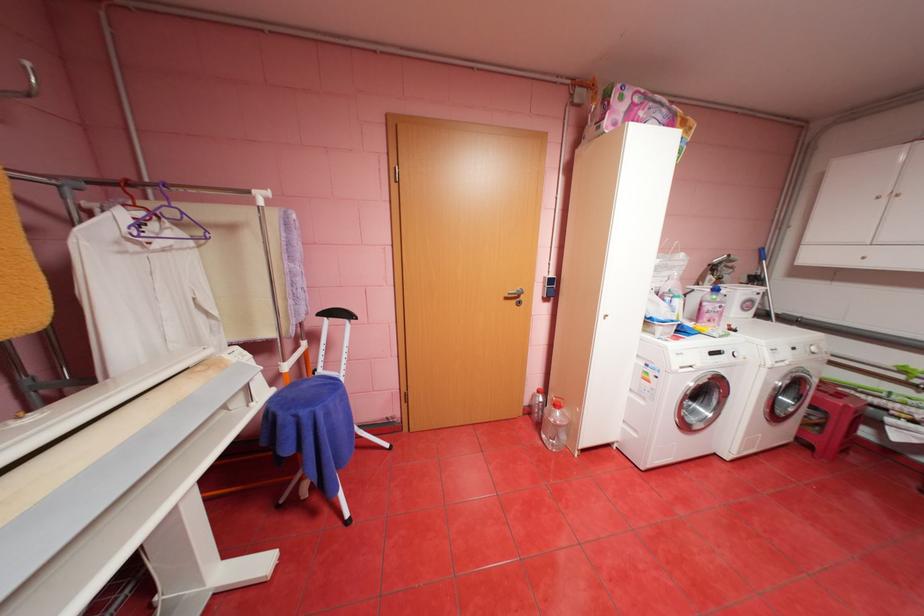
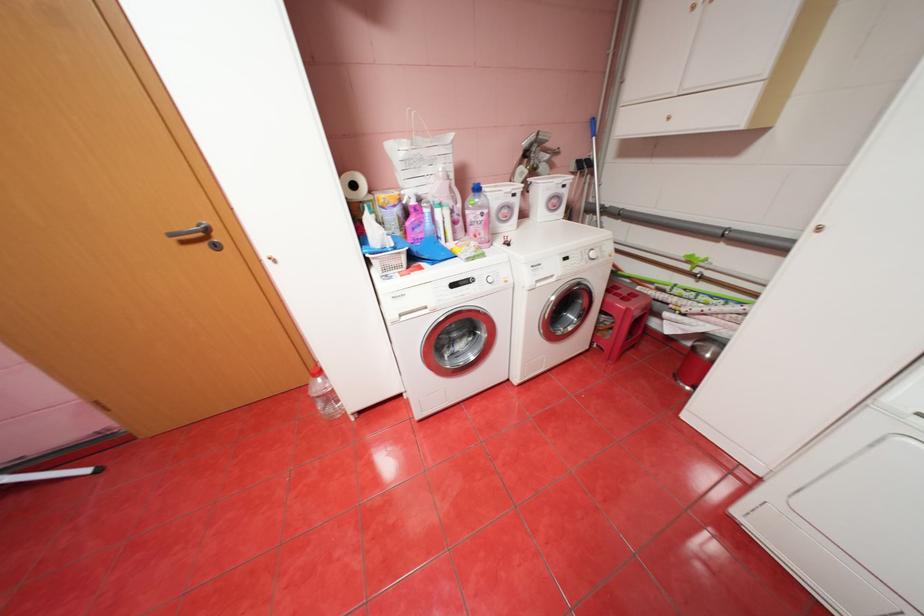
Find the pixel in the second image that matches (715,315) in the first image.

(480, 228)